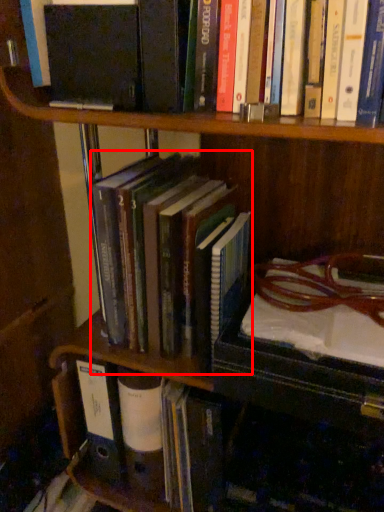
Question: From the image, what is the correct spatial relationship of book (annotated by the red box) in relation to book?

Choices:
 (A) right
 (B) left

Answer: (A)